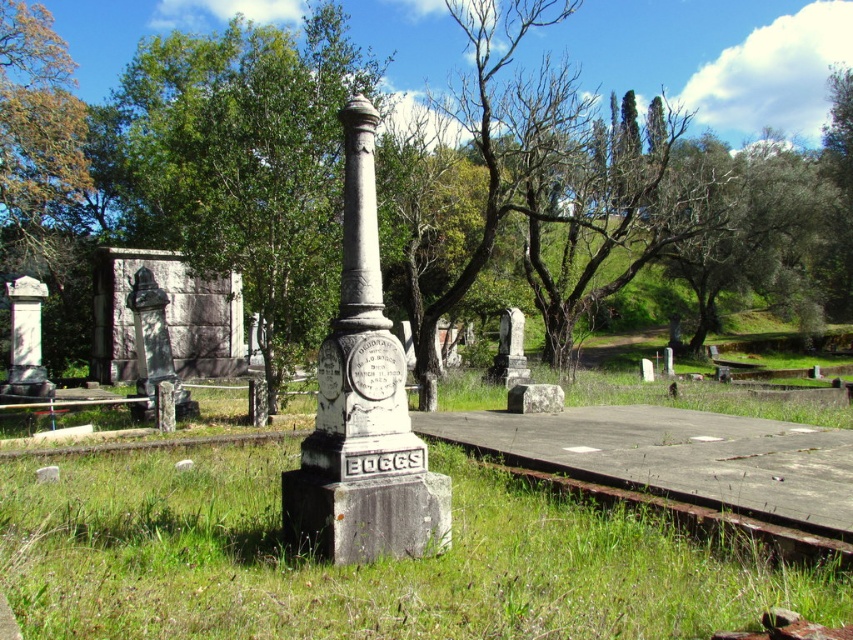
Question: Among these objects, which one is nearest to the camera?

Choices:
 (A) bronze statue at left
 (B) green leafy tree at center

Answer: (B)

Question: Can you confirm if green grass at center is smaller than bronze statue at left?

Choices:
 (A) yes
 (B) no

Answer: (A)

Question: Is green leafy tree at center to the left of bronze statue at left from the viewer's perspective?

Choices:
 (A) yes
 (B) no

Answer: (B)

Question: Is green grass at center below bronze statue at left?

Choices:
 (A) yes
 (B) no

Answer: (A)

Question: Estimate the real-world distances between objects in this image. Which object is farther from the bronze statue at left?

Choices:
 (A) green leafy tree at center
 (B) green grass at center

Answer: (A)

Question: Which of the following is the closest to the observer?

Choices:
 (A) green grass at center
 (B) bronze statue at left
 (C) green leafy tree at center

Answer: (A)